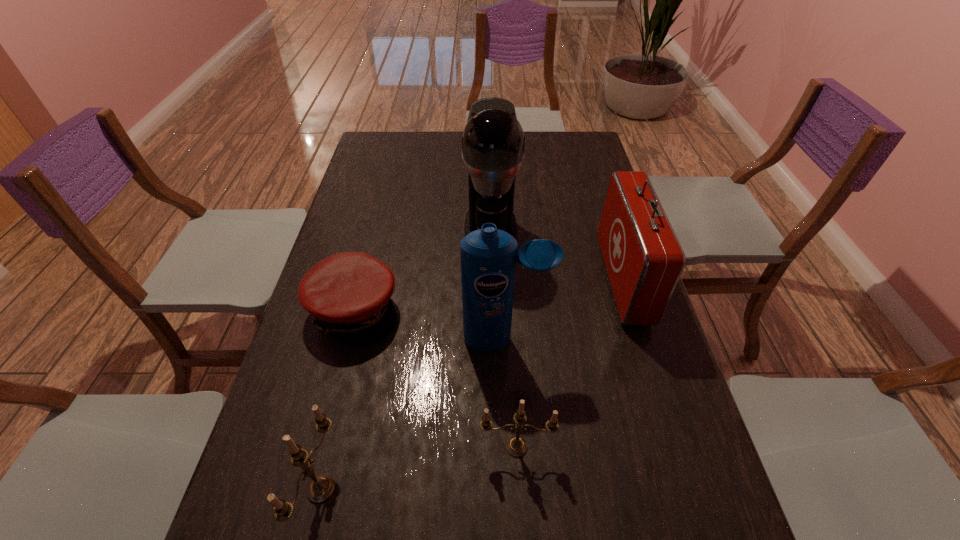
Please point a free position for a candle on the right. Please provide its 2D coordinates. Your answer should be formatted as a tuple, i.e. [(x, y)], where the tuple contains the x and y coordinates of a point satisfying the conditions above.

[(688, 409)]